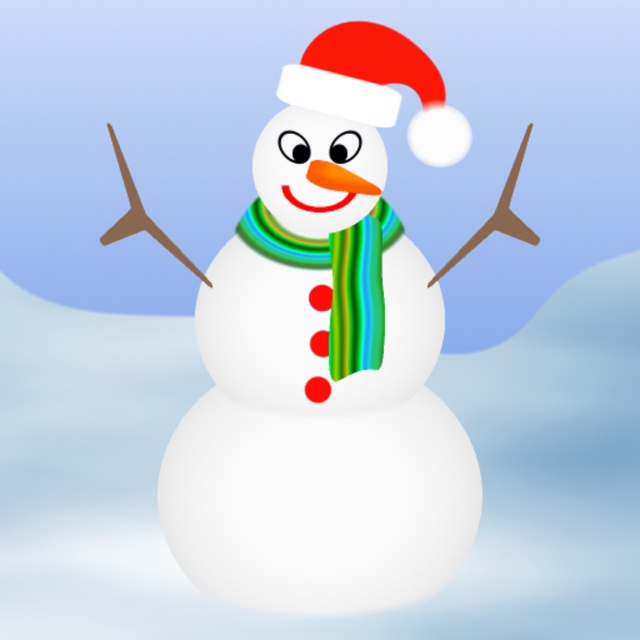
Question: Which of these objects is positioned closest to the matte red santa hat at upper center?

Choices:
 (A) green striped scarf at center
 (B) white matte snowman at center

Answer: (A)

Question: Which point is closer to the camera taking this photo?

Choices:
 (A) (451, 152)
 (B) (337, 138)

Answer: (B)

Question: Which point is farther from the camera taking this photo?

Choices:
 (A) (301, 221)
 (B) (444, 136)

Answer: (B)

Question: Is white matte snowman at center above green striped scarf at center?

Choices:
 (A) no
 (B) yes

Answer: (A)

Question: Observing the image, what is the correct spatial positioning of white matte snowman at center in reference to matte red santa hat at upper center?

Choices:
 (A) above
 (B) below

Answer: (B)

Question: Is white matte snowman at center bigger than matte red santa hat at upper center?

Choices:
 (A) no
 (B) yes

Answer: (B)